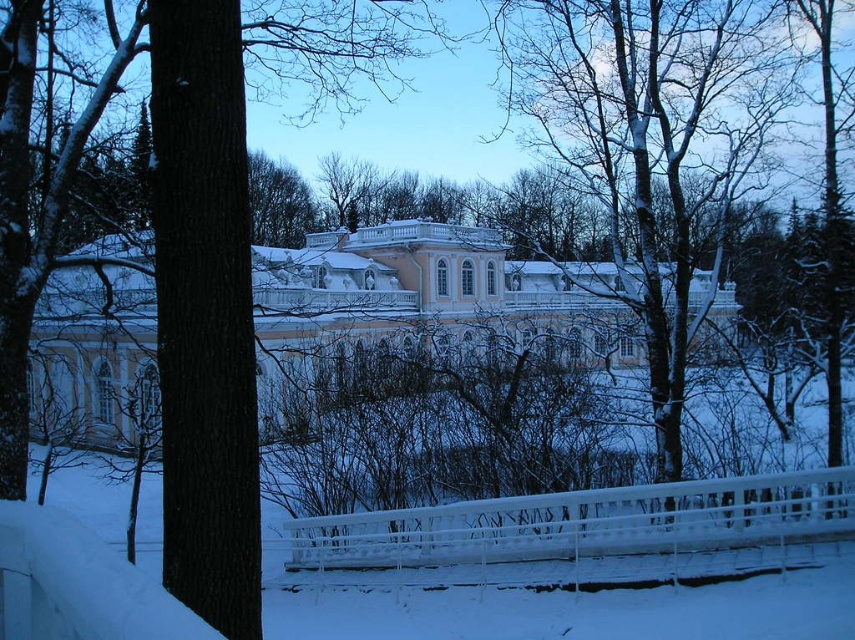
Does white glossy palace at center come behind smooth bark tree at center?

Yes, it is behind smooth bark tree at center.

Locate an element on the screen. Image resolution: width=855 pixels, height=640 pixels. white glossy palace at center is located at coordinates (423, 298).